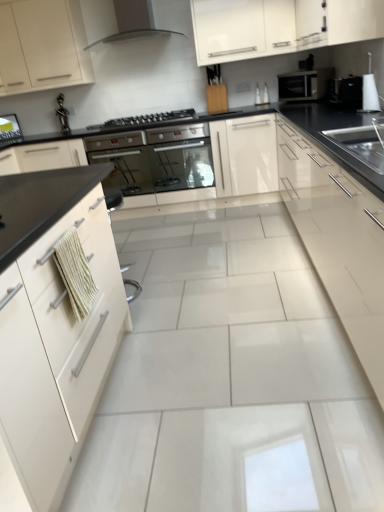
Locate an element on the screen. This screenshot has width=384, height=512. matte black range hood at upper center is located at coordinates (129, 23).

The image size is (384, 512). What do you see at coordinates (338, 241) in the screenshot?
I see `glossy cream cabinet at right, arranged as the 4th cabinetry when viewed from the left` at bounding box center [338, 241].

What do you see at coordinates (63, 115) in the screenshot? I see `metallic figurine at upper left` at bounding box center [63, 115].

I want to click on black glossy microwave at upper right, which is the 2th appliance in front-to-back order, so click(345, 91).

Is metallic figurine at upper left positioned with its back to satin silver microwave at upper right?

No, metallic figurine at upper left is not facing away from satin silver microwave at upper right.

Considering the positions of point (60, 113) and point (316, 98), is point (60, 113) closer or farther from the camera than point (316, 98)?

Point (60, 113) is positioned farther from the camera compared to point (316, 98).

Which object is wider, metallic figurine at upper left or satin silver microwave at upper right?

satin silver microwave at upper right is wider.

In terms of width, does satin silver microwave at upper right look wider or thinner when compared to matte black range hood at upper center?

In the image, satin silver microwave at upper right appears to be more narrow than matte black range hood at upper center.

From a real-world perspective, is satin silver microwave at upper right below matte black range hood at upper center?

Indeed, from a real-world perspective, satin silver microwave at upper right is positioned beneath matte black range hood at upper center.

Who is taller, satin silver microwave at upper right or matte black range hood at upper center?

With more height is matte black range hood at upper center.

In the image, is satin silver microwave at upper right on the left side or the right side of matte black range hood at upper center?

satin silver microwave at upper right is to the right of matte black range hood at upper center.

I want to click on microwave oven that appears below the white glossy cabinet at upper left, acting as the 4th cabinetry starting from the right (from a real-world perspective), so click(304, 84).

Is satin silver microwave at upper right facing away from white glossy cabinet at upper left, acting as the 4th cabinetry starting from the right?

That's not correct — satin silver microwave at upper right is not looking away from white glossy cabinet at upper left, acting as the 4th cabinetry starting from the right.

Can you confirm if satin silver microwave at upper right is wider than white glossy cabinet at upper left, acting as the 4th cabinetry starting from the right?

In fact, satin silver microwave at upper right might be narrower than white glossy cabinet at upper left, acting as the 4th cabinetry starting from the right.

From a real-world perspective, is satin silver microwave at upper right below white glossy cabinet at upper left, the first cabinetry when ordered from left to right?

Indeed, from a real-world perspective, satin silver microwave at upper right is positioned beneath white glossy cabinet at upper left, the first cabinetry when ordered from left to right.

From a real-world perspective, is black glossy microwave at upper right, which is the 2th appliance in front-to-back order, located higher than white glossy cabinet at left, the 3th cabinetry viewed from the right?

Yes, from a real-world perspective, black glossy microwave at upper right, which is the 2th appliance in front-to-back order, is over white glossy cabinet at left, the 3th cabinetry viewed from the right

Does black glossy microwave at upper right, which appears as the 1th appliance when viewed from the back, have a smaller size compared to white glossy cabinet at left, placed as the 2th cabinetry when sorted from left to right?

Yes, black glossy microwave at upper right, which appears as the 1th appliance when viewed from the back, is smaller than white glossy cabinet at left, placed as the 2th cabinetry when sorted from left to right.

This screenshot has width=384, height=512. Find the location of `the 2nd cabinetry in front of the black glossy microwave at upper right, which appears as the 1th appliance when viewed from the back`. the 2nd cabinetry in front of the black glossy microwave at upper right, which appears as the 1th appliance when viewed from the back is located at coordinates (57, 354).

Is white glossy cabinet at left, placed as the 2th cabinetry when sorted from left to right, surrounded by black glossy microwave at upper right, which is the 2th appliance in front-to-back order?

No, black glossy microwave at upper right, which is the 2th appliance in front-to-back order, does not contain white glossy cabinet at left, placed as the 2th cabinetry when sorted from left to right.

Is glossy cream cabinet at right, the first cabinetry in the right-to-left sequence, in front of or behind metallic figurine at upper left in the image?

glossy cream cabinet at right, the first cabinetry in the right-to-left sequence, is in front of metallic figurine at upper left.

Which is less distant, (329, 212) or (59, 104)?

Clearly, point (329, 212) is closer to the camera than point (59, 104).

In terms of size, does glossy cream cabinet at right, the first cabinetry in the right-to-left sequence, appear bigger or smaller than metallic figurine at upper left?

Clearly, glossy cream cabinet at right, the first cabinetry in the right-to-left sequence, is larger in size than metallic figurine at upper left.

From the image's perspective, is metallic figurine at upper left below matte black range hood at upper center?

Yes, from the image's perspective, metallic figurine at upper left is below matte black range hood at upper center.

Is metallic figurine at upper left aimed at matte black range hood at upper center?

No, metallic figurine at upper left is not turned towards matte black range hood at upper center.

From the picture: Does metallic figurine at upper left touch matte black range hood at upper center?

They are not placed beside each other.

Is metallic figurine at upper left wider than matte black range hood at upper center?

No.

Is metallic figurine at upper left further to camera compared to satin black oven at center, which is counted as the second oven, starting from the left?

Yes, it is.

From the image's perspective, which one is positioned higher, metallic figurine at upper left or satin black oven at center, the 1th oven in the right-to-left sequence?

metallic figurine at upper left, from the image's perspective.

Considering the sizes of objects metallic figurine at upper left and satin black oven at center, which is counted as the second oven, starting from the left, in the image provided, who is shorter, metallic figurine at upper left or satin black oven at center, which is counted as the second oven, starting from the left,?

Standing shorter between the two is metallic figurine at upper left.

Where is `faucet behind the satin silver microwave at upper right`? faucet behind the satin silver microwave at upper right is located at coordinates (63, 115).

Locate an element on the screen. home appliance in front of the satin silver microwave at upper right is located at coordinates (129, 23).

Estimate the real-world distances between objects in this image. Which object is further from white glossy cabinet at upper center, marked as the third cabinetry in a left-to-right arrangement, black glass gas stove at center or metallic figurine at upper left?

Among the two, metallic figurine at upper left is located further to white glossy cabinet at upper center, marked as the third cabinetry in a left-to-right arrangement.

Based on their spatial positions, is white glossy cabinet at upper left, the first cabinetry when ordered from left to right, or metallic figurine at upper left closer to black glass gas stove at center?

white glossy cabinet at upper left, the first cabinetry when ordered from left to right, is closer to black glass gas stove at center.

Estimate the real-world distances between objects in this image. Which object is closer to white glossy kettle at upper right, the 2th appliance when ordered from back to front, black glass gas stove at center or white glossy cabinet at left, placed as the 2th cabinetry when sorted from left to right?

black glass gas stove at center is positioned closer to the anchor white glossy kettle at upper right, the 2th appliance when ordered from back to front.

Considering their positions, is white glossy cabinet at upper left, the first cabinetry when ordered from left to right, positioned further to matte black range hood at upper center than black glossy microwave at upper right, which appears as the 1th appliance when viewed from the back?

Among the two, black glossy microwave at upper right, which appears as the 1th appliance when viewed from the back, is located further to matte black range hood at upper center.

From the image, which object appears to be nearer to white glossy cabinet at upper left, acting as the 4th cabinetry starting from the right, white glossy kettle at upper right, which is counted as the 1th appliance, starting from the front, or white glossy cabinet at upper center, the 2th cabinetry when ordered from right to left?

white glossy cabinet at upper center, the 2th cabinetry when ordered from right to left, is positioned closer to the anchor white glossy cabinet at upper left, acting as the 4th cabinetry starting from the right.

Based on their spatial positions, is black glass gas stove at center or stainless steel oven at center, the 2th oven when ordered from right to left, further from black glossy microwave at upper right, which is the 2th appliance in front-to-back order?

stainless steel oven at center, the 2th oven when ordered from right to left, is further to black glossy microwave at upper right, which is the 2th appliance in front-to-back order.

When comparing their distances from white glossy cabinet at upper left, acting as the 4th cabinetry starting from the right, does satin black oven at center, the 1th oven in the right-to-left sequence, or white glossy kettle at upper right, the 2th appliance when ordered from back to front, seem further?

white glossy kettle at upper right, the 2th appliance when ordered from back to front, is further to white glossy cabinet at upper left, acting as the 4th cabinetry starting from the right.

From the picture: Estimate the real-world distances between objects in this image. Which object is closer to satin silver microwave at upper right, satin black oven at center, which is counted as the second oven, starting from the left, or matte black range hood at upper center?

The object closer to satin silver microwave at upper right is satin black oven at center, which is counted as the second oven, starting from the left.

This screenshot has width=384, height=512. I want to click on faucet located between white glossy cabinet at upper left, acting as the 4th cabinetry starting from the right, and matte black range hood at upper center in the left-right direction, so click(63, 115).

Where is `home appliance positioned between glossy cream cabinet at right, arranged as the 4th cabinetry when viewed from the left, and white glossy cabinet at upper left, the first cabinetry when ordered from left to right, from near to far`? Image resolution: width=384 pixels, height=512 pixels. home appliance positioned between glossy cream cabinet at right, arranged as the 4th cabinetry when viewed from the left, and white glossy cabinet at upper left, the first cabinetry when ordered from left to right, from near to far is located at coordinates (129, 23).

You are a GUI agent. You are given a task and a screenshot of the screen. Output one action in this format:
    pyautogui.click(x=<x>, y=<y>)
    Task: Click on the gas stove located between stainless steel oven at center, the 2th oven when ordered from right to left, and white glossy cabinet at upper center, the 2th cabinetry when ordered from right to left, in the left-right direction
    This screenshot has width=384, height=512.
    Given the screenshot: What is the action you would take?
    (x=148, y=119)

At what (x,y) coordinates should I click in order to perform the action: click on appliance situated between matte black range hood at upper center and black glossy microwave at upper right, which appears as the 1th appliance when viewed from the back, from left to right. Please return your answer as a coordinate pair (x, y). Image resolution: width=384 pixels, height=512 pixels. Looking at the image, I should click on (369, 91).